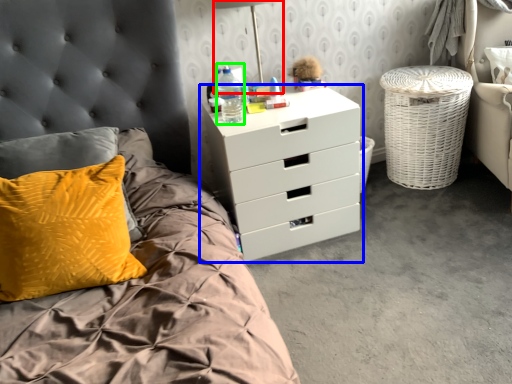
Question: Which object is positioned farthest from bedside lamp (highlighted by a red box)? Select from chest of drawers (highlighted by a blue box) and bottle (highlighted by a green box).

Choices:
 (A) chest of drawers
 (B) bottle

Answer: (A)